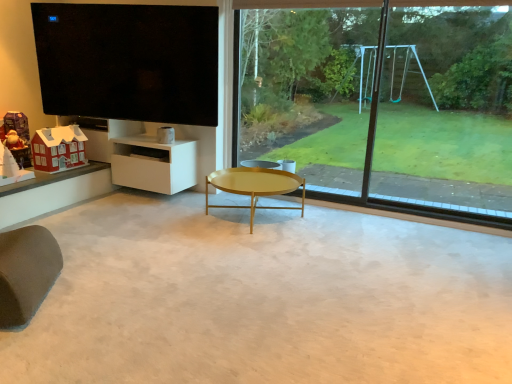
You are a GUI agent. You are given a task and a screenshot of the screen. Output one action in this format:
    pyautogui.click(x=<x>, y=<y>)
    Task: Click on the vacant space to the left of gold metallic coffee table at center
    
    Given the screenshot: What is the action you would take?
    coord(167,216)